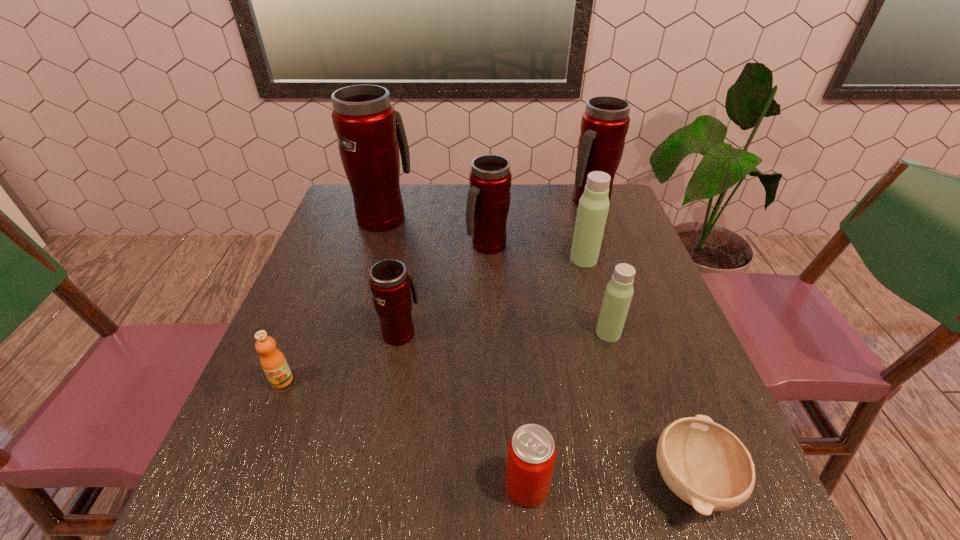
At what (x,y) coordinates should I click in order to perform the action: click on the tallest object. Please return your answer as a coordinate pair (x, y). The height and width of the screenshot is (540, 960). Looking at the image, I should click on (370, 133).

Locate an element on the screen. The width and height of the screenshot is (960, 540). the biggest red thermos bottle is located at coordinates (370, 133).

Identify the location of the second tallest object. Image resolution: width=960 pixels, height=540 pixels. tap(604, 125).

Find the location of a particular element. The image size is (960, 540). the rightmost red thermos bottle is located at coordinates (604, 125).

Where is `the third red thermos bottle from left to right`? This screenshot has width=960, height=540. the third red thermos bottle from left to right is located at coordinates (488, 202).

Identify the location of the third thermos bottle from left to right. (488, 202).

I want to click on the bigger light thermos bottle, so click(593, 207).

Identify the location of the smallest red thermos bottle. pyautogui.click(x=390, y=282).

This screenshot has height=540, width=960. Identify the location of the nearer light thermos bottle. (619, 291).

This screenshot has height=540, width=960. What are the coordinates of `the leftmost object` in the screenshot? It's located at (273, 362).